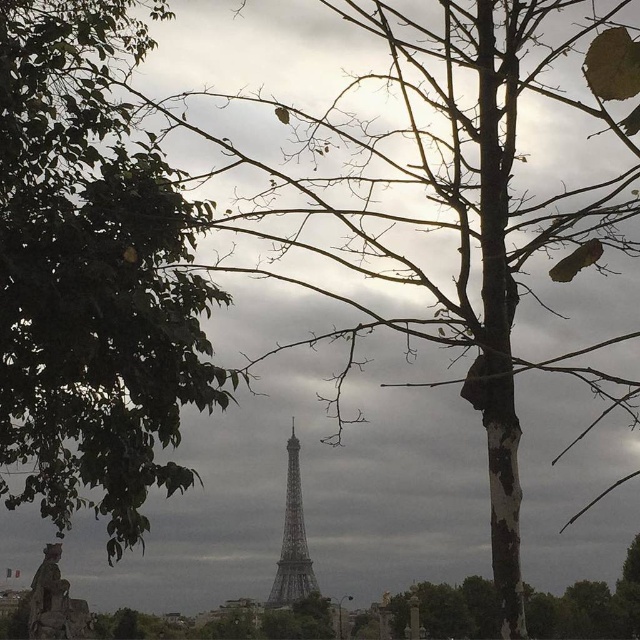
Question: Is green leafy tree at left positioned at the back of metallic gray eiffel tower at center?

Choices:
 (A) yes
 (B) no

Answer: (B)

Question: Which object appears closest to the camera in this image?

Choices:
 (A) metallic gray eiffel tower at center
 (B) green leafy tree at left

Answer: (B)

Question: Is green leafy tree at left above metallic gray eiffel tower at center?

Choices:
 (A) yes
 (B) no

Answer: (A)

Question: Is green leafy tree at left positioned in front of metallic gray eiffel tower at center?

Choices:
 (A) yes
 (B) no

Answer: (A)

Question: Which object appears farthest from the camera in this image?

Choices:
 (A) green leafy tree at left
 (B) metallic gray eiffel tower at center

Answer: (B)